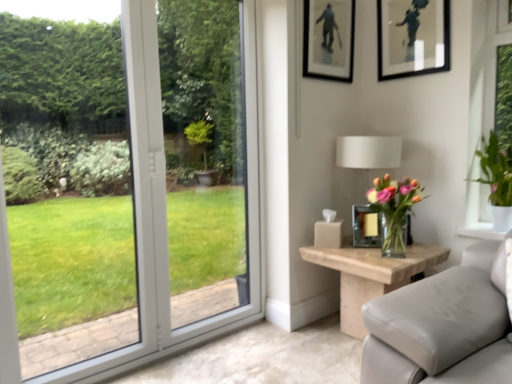
Question: From the image's perspective, is natural wood side table at right above or below white fabric lampshade at upper right?

Choices:
 (A) above
 (B) below

Answer: (B)

Question: Looking at the image, does natural wood side table at right seem bigger or smaller compared to white fabric lampshade at upper right?

Choices:
 (A) big
 (B) small

Answer: (A)

Question: Considering the real-world distances, which object is farthest from the matte black picture frame at upper center, which is counted as the 2th picture frame, starting from the top?

Choices:
 (A) translucent glass vase at right, the 2th houseplant positioned from the right
 (B) white fabric lampshade at upper right
 (C) natural wood side table at right
 (D) green leafy plant at right, arranged as the second houseplant when viewed from the left
 (E) metallic gold picture frame at right, which is counted as the third picture frame, starting from the top

Answer: (C)

Question: Which object is positioned farthest from the green leafy plant at right, which is the first houseplant in right-to-left order?

Choices:
 (A) metallic gold picture frame at right, positioned as the 2th picture frame in right-to-left order
 (B) matte black picture frame at upper center, positioned as the first picture frame in left-to-right order
 (C) translucent glass vase at right, the 2th houseplant positioned from the right
 (D) matte black picture frame at upper right, the 3th picture frame ordered from the bottom
 (E) white fabric lampshade at upper right

Answer: (B)